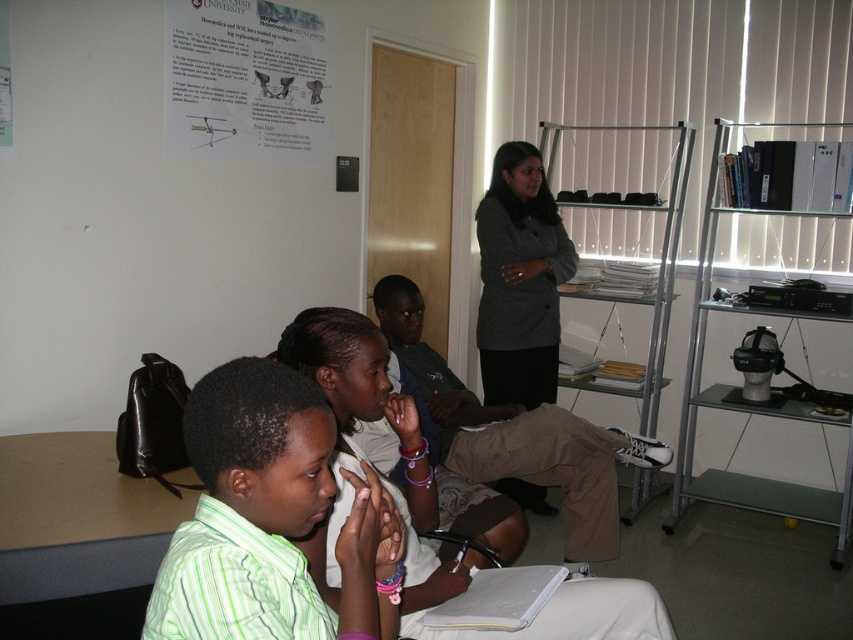
Question: Is white paper at upper left positioned behind light brown fabric pants at center?

Choices:
 (A) no
 (B) yes

Answer: (B)

Question: Which object is closer to the camera taking this photo?

Choices:
 (A) white paper at upper left
 (B) brown leather table at lower left

Answer: (B)

Question: Which point is closer to the camera?

Choices:
 (A) (524, 456)
 (B) (309, 42)

Answer: (A)

Question: Which point is closer to the camera?

Choices:
 (A) (57, 502)
 (B) (514, 321)

Answer: (A)

Question: Is brown leather table at lower left further to the viewer compared to light brown fabric pants at center?

Choices:
 (A) no
 (B) yes

Answer: (A)

Question: Does green striped shirt at center have a greater width compared to dark gray blazer at center?

Choices:
 (A) no
 (B) yes

Answer: (A)